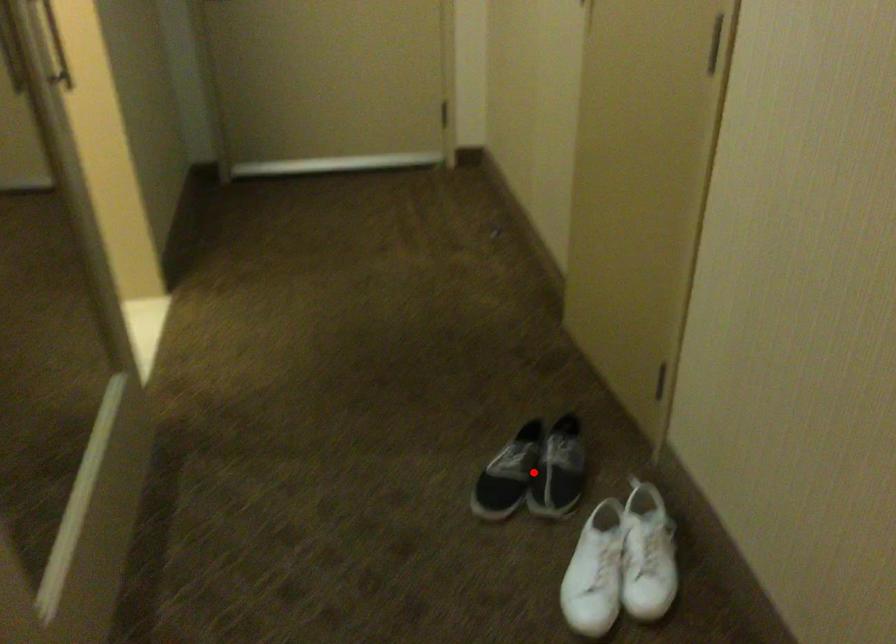
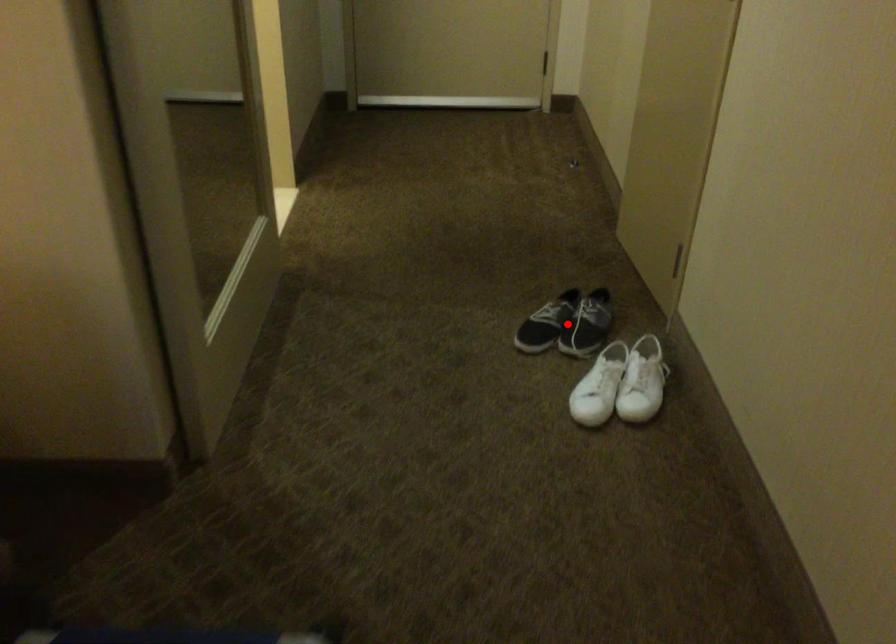
I am providing you with two images of the same scene from different viewpoints. A red point is marked on the first image and another point is marked on the second image. Is the red point in image1 aligned with the point shown in image2?

Yes